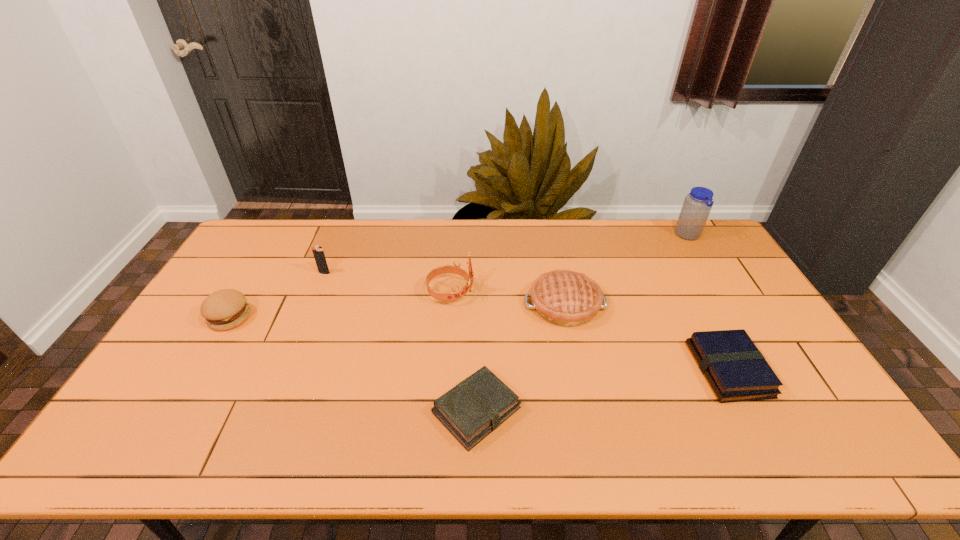
Find the location of a particular element. This screenshot has height=540, width=960. free region located 0.350m with a carrying loop on the side of the farthest object is located at coordinates (583, 236).

Identify the location of vacant space located 0.180m on the front-facing side of the tiara. The image size is (960, 540). (530, 292).

The image size is (960, 540). What are the coordinates of `free location located on the front of the second object from left to right` in the screenshot? It's located at (285, 368).

This screenshot has width=960, height=540. In order to click on vacant space located on the back of the pie in this screenshot , I will do `click(557, 264)`.

In order to click on vacant position located 0.120m on the front of the hamburger in this screenshot , I will do `click(202, 366)`.

Identify the location of vacant space located 0.090m on the back of the right book. This screenshot has height=540, width=960. (701, 318).

The image size is (960, 540). Identify the location of vacant space located on the back of the left book. (477, 350).

Identify the location of object that is at the far edge. (697, 205).

The image size is (960, 540). I want to click on object present at the near edge, so click(x=475, y=407).

Where is `object at the left edge`? This screenshot has width=960, height=540. object at the left edge is located at coordinates tap(225, 309).